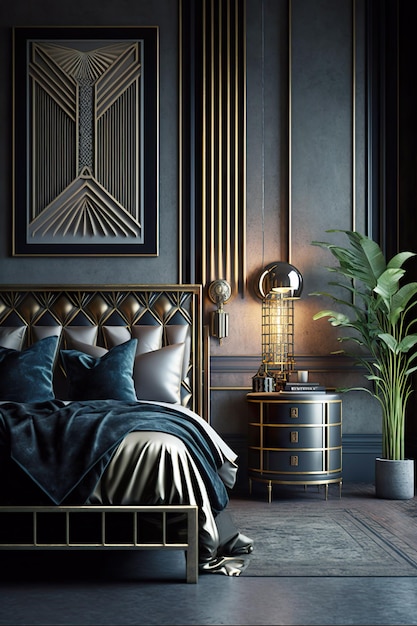
Find the location of a particular element. The height and width of the screenshot is (626, 417). pillowcase is located at coordinates (158, 380), (86, 347).